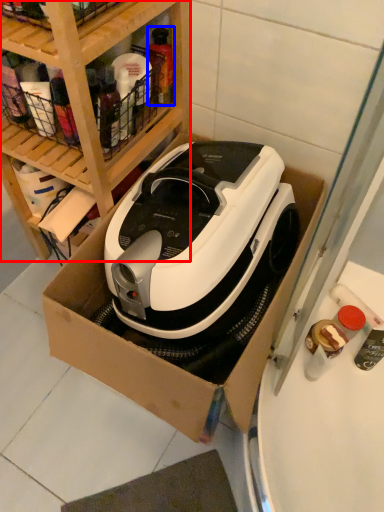
Question: Which object appears farthest to the camera in this image, shelf (highlighted by a red box) or bottle (highlighted by a blue box)?

Choices:
 (A) shelf
 (B) bottle

Answer: (B)